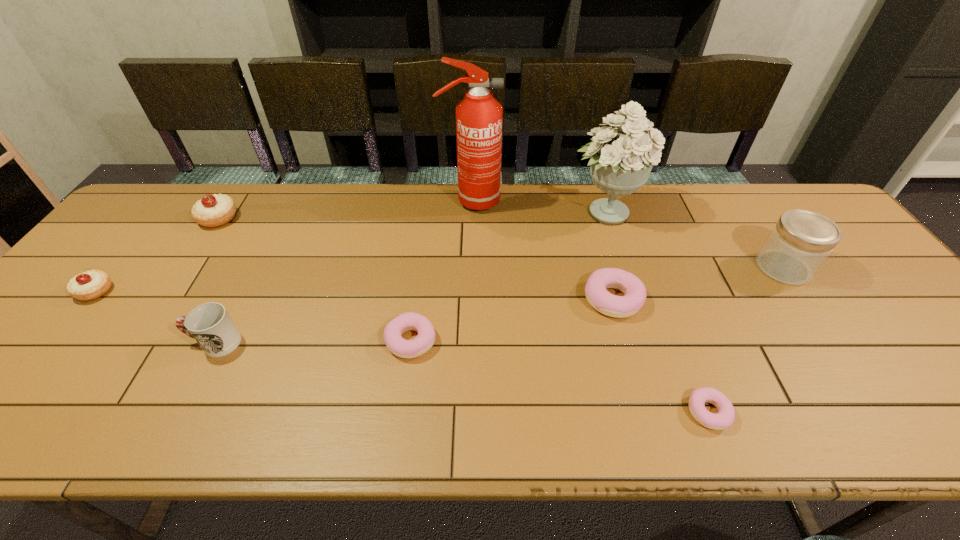
Locate an element on the screen. unoccupied position between the second shortest pastry and the rightmost pink pastry is located at coordinates (560, 376).

Find the location of a particular element. The image size is (960, 540). free space between the left beige pastry and the second tallest object is located at coordinates (350, 252).

The width and height of the screenshot is (960, 540). In order to click on vacant space that's between the jar and the smaller beige pastry in this screenshot , I will do `click(439, 279)`.

The width and height of the screenshot is (960, 540). I want to click on empty space that is in between the cup and the leftmost pink pastry, so click(x=313, y=341).

The image size is (960, 540). In order to click on free space between the third pastry from right to left and the green bouquet in this screenshot , I will do tap(508, 276).

Locate an element on the screen. This screenshot has height=540, width=960. empty location between the red cup and the jar is located at coordinates (499, 305).

At what (x,y) coordinates should I click in order to perform the action: click on object identified as the eighth closest to the nearer beige pastry. Please return your answer as a coordinate pair (x, y). The image size is (960, 540). Looking at the image, I should click on (801, 241).

Locate an element on the screen. The image size is (960, 540). object that is the fourth nearest to the farthest pastry is located at coordinates (425, 339).

Locate which pastry is the closest to the rightmost pastry. Please provide its 2D coordinates. Your answer should be formatted as a tuple, i.e. [(x, y)], where the tuple contains the x and y coordinates of a point satisfying the conditions above.

[(599, 298)]

Choose which pastry is the third nearest neighbor to the leftmost pastry. Please provide its 2D coordinates. Your answer should be formatted as a tuple, i.e. [(x, y)], where the tuple contains the x and y coordinates of a point satisfying the conditions above.

[(599, 298)]